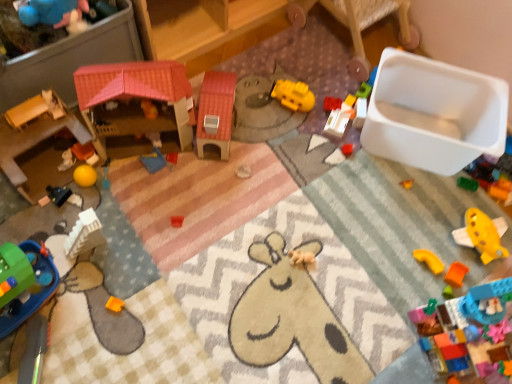
What are the coordinates of `vacant area located to the right-hand side of yellow matte plastic arch at lower right, which appears as the twelfth toy when viewed from the left` in the screenshot? It's located at (459, 258).